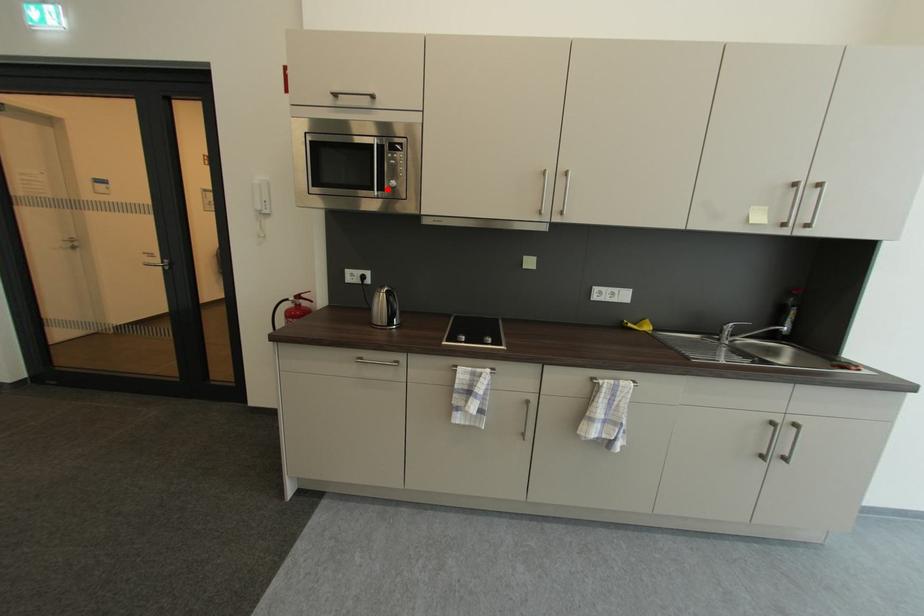
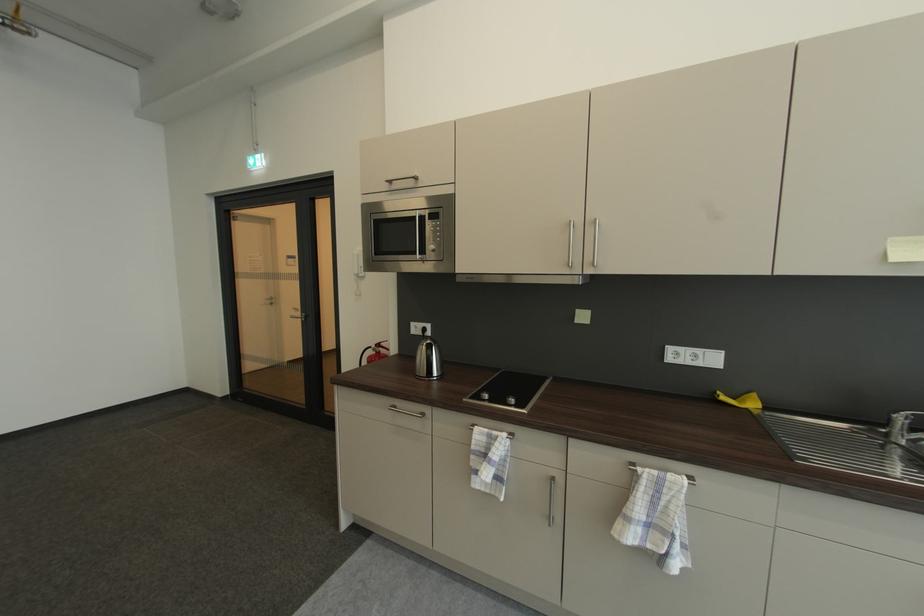
Find the pixel in the second image that matches the highlighted location in the first image.

(430, 254)